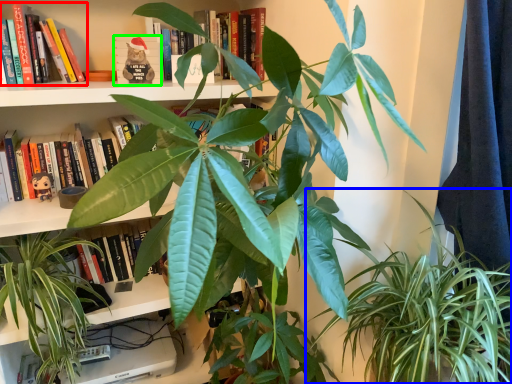
Question: Estimate the real-world distances between objects in this image. Which object is closer to book (highlighted by a red box), houseplant (highlighted by a blue box) or paperback book (highlighted by a green box)?

Choices:
 (A) houseplant
 (B) paperback book

Answer: (B)